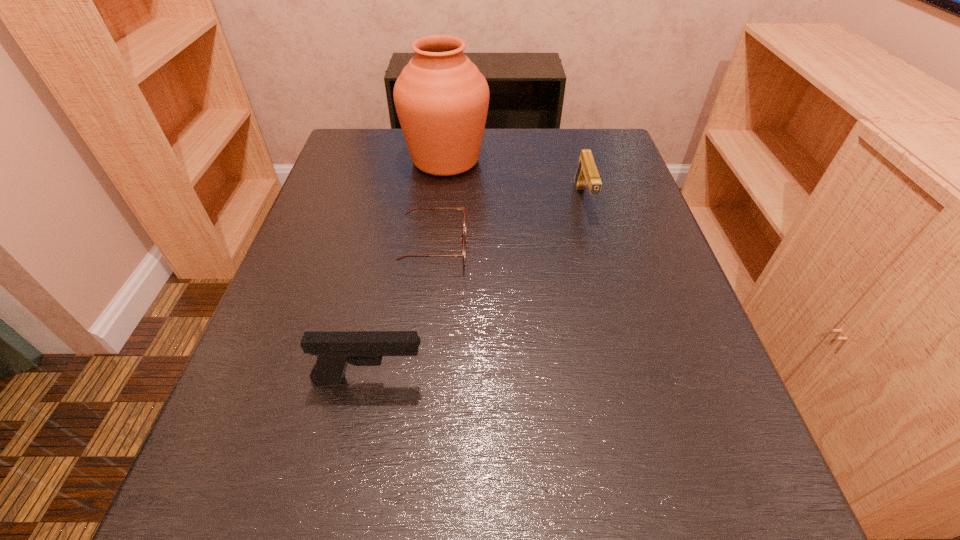
Locate an element on the screen. object that stands as the third closest to the tallest object is located at coordinates (334, 350).

Identify the location of vacant space that satisfies the following two spatial constraints: 1. at the barrel of the right pistol; 2. on the front-facing side of the left pistol. The width and height of the screenshot is (960, 540). (632, 380).

Find the location of a particular element. The image size is (960, 540). free spot that satisfies the following two spatial constraints: 1. at the barrel of the right pistol; 2. on the front-facing side of the nearest object is located at coordinates (x=632, y=380).

Where is `free point that satisfies the following two spatial constraints: 1. at the barrel of the farther pistol; 2. on the front-facing side of the nearest object`? The width and height of the screenshot is (960, 540). free point that satisfies the following two spatial constraints: 1. at the barrel of the farther pistol; 2. on the front-facing side of the nearest object is located at coordinates (632, 380).

Image resolution: width=960 pixels, height=540 pixels. I want to click on vacant area in the image that satisfies the following two spatial constraints: 1. at the barrel of the rightmost object; 2. on the front-facing side of the nearest object, so click(x=632, y=380).